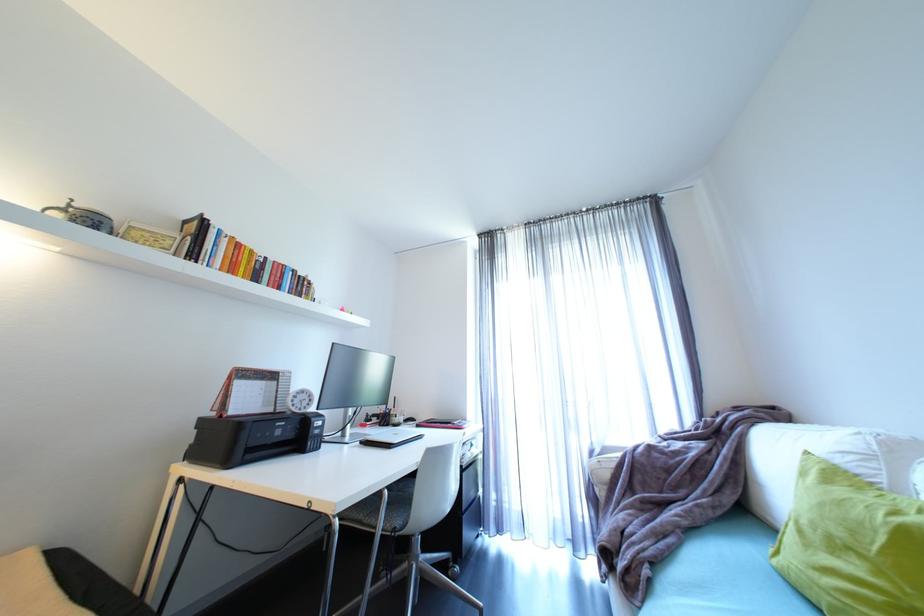
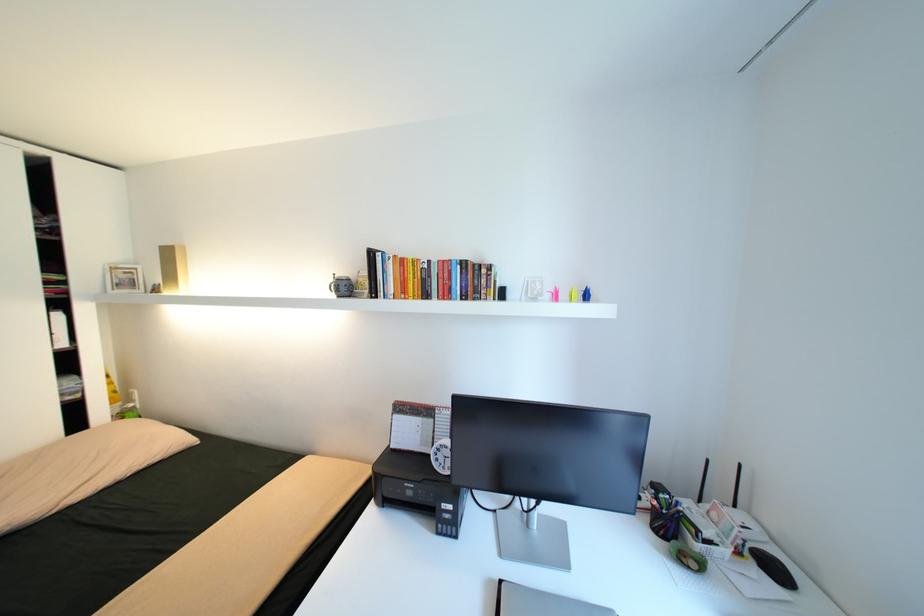
Question: I am providing you with two images of the same scene from different viewpoints. Please identify which objects are invisible in image2.

Choices:
 (A) white desk clock
 (B) yellow origami crane
 (C) pink origami crane
 (D) none of these

Answer: (D)